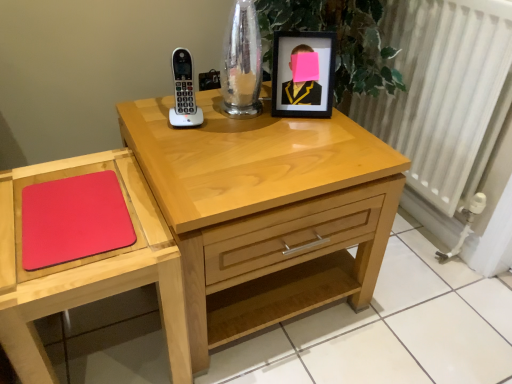
Question: Considering the positions of white textured radiator at right and light wood nightstand at center in the image, is white textured radiator at right bigger or smaller than light wood nightstand at center?

Choices:
 (A) small
 (B) big

Answer: (A)

Question: Is white textured radiator at right taller or shorter than light wood nightstand at center?

Choices:
 (A) tall
 (B) short

Answer: (A)

Question: Estimate the real-world distances between objects in this image. Which object is closer to the black matte picture frame at upper right?

Choices:
 (A) matte wooden mouse pad at lower left
 (B) rubberized red mousepad at lower left
 (C) white textured radiator at right
 (D) white plastic phone at upper center
 (E) light wood nightstand at center

Answer: (D)

Question: Considering the real-world distances, which object is farthest from the matte wooden mouse pad at lower left?

Choices:
 (A) rubberized red mousepad at lower left
 (B) black matte picture frame at upper right
 (C) white plastic phone at upper center
 (D) light wood nightstand at center
 (E) white textured radiator at right

Answer: (E)